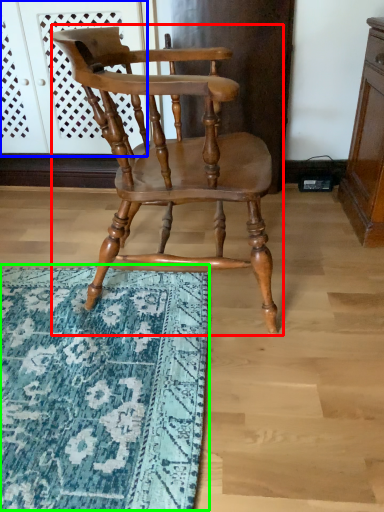
Question: Which is farther away from chair (highlighted by a red box)? screen door (highlighted by a blue box) or mat (highlighted by a green box)?

Choices:
 (A) screen door
 (B) mat

Answer: (A)